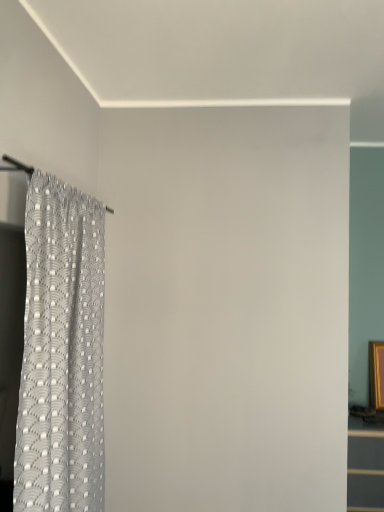
This screenshot has width=384, height=512. What do you see at coordinates (61, 353) in the screenshot?
I see `white dotted fabric curtain at left` at bounding box center [61, 353].

Measure the distance between white dotted fabric curtain at left and camera.

white dotted fabric curtain at left is 1.28 meters from camera.

This screenshot has height=512, width=384. I want to click on white dotted fabric curtain at left, so click(61, 353).

This screenshot has width=384, height=512. Find the location of `white dotted fabric curtain at left`. white dotted fabric curtain at left is located at coordinates (61, 353).